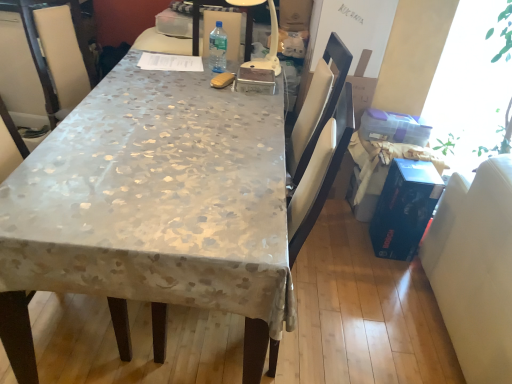
Locate an element on the screen. vacant space to the left of blue cardboard box at right is located at coordinates (352, 249).